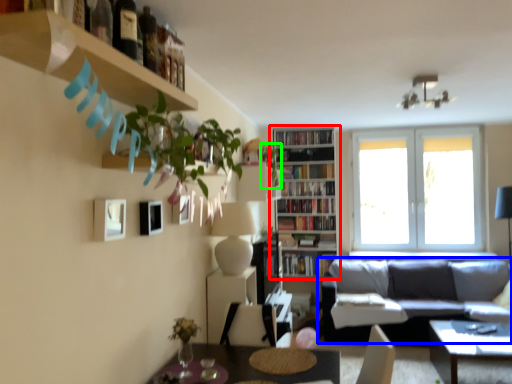
Question: Which object is the farthest from bookcase (highlighted by a red box)? Choose among these: studio couch (highlighted by a blue box) or plant (highlighted by a green box).

Choices:
 (A) studio couch
 (B) plant

Answer: (A)